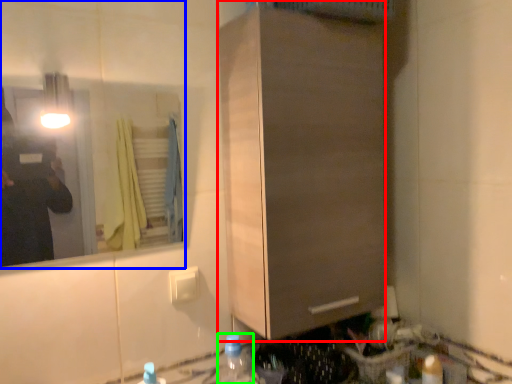
Question: Which object is the closest to the cabinetry (highlighted by a red box)? Choose among these: mirror (highlighted by a blue box) or bottle (highlighted by a green box).

Choices:
 (A) mirror
 (B) bottle

Answer: (B)